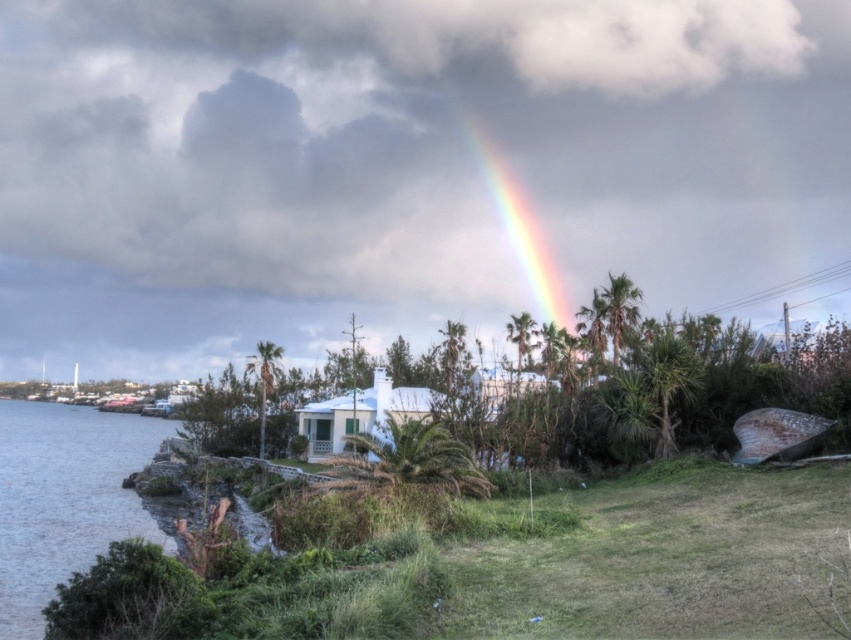
Question: Is clear water at lower left wider than rainbow at upper center?

Choices:
 (A) no
 (B) yes

Answer: (B)

Question: Can you confirm if clear water at lower left is wider than rainbow at upper center?

Choices:
 (A) yes
 (B) no

Answer: (A)

Question: Can you confirm if clear water at lower left is smaller than rainbow at upper center?

Choices:
 (A) yes
 (B) no

Answer: (A)